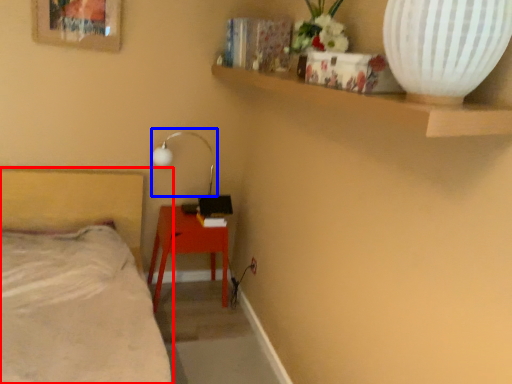
Question: Among these objects, which one is farthest to the camera, bed (highlighted by a red box) or lamp (highlighted by a blue box)?

Choices:
 (A) bed
 (B) lamp

Answer: (B)